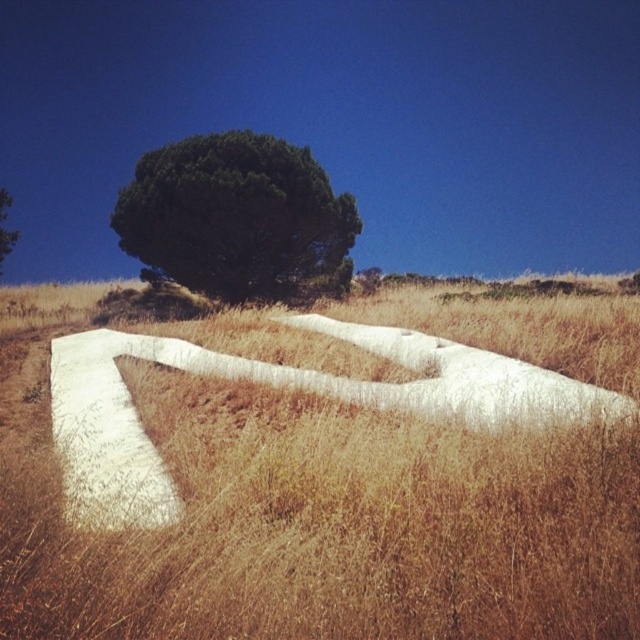
You are a botanist studying plant distribution in this landscape. You observe the dry grass at center. Based on its location coordinates, can you determine whether it is positioned closer to the bottom or the top of the image?

The dry grass at center is located at coordinates point [317,522]. Since the y coordinate is 0.498, which is just below the halfway point of the image, it is closer to the bottom of the image.

You are standing in the field of dry grass and want to walk towards the green leafy tree at upper center and the green leafy tree at upper left. Which tree will you reach first?

The green leafy tree at upper center will be reached first because it is closer to the viewer than the green leafy tree at upper left.

You are a photographer trying to capture the green leafy tree at upper left while ensuring the dry grass at center is visible in the foreground. Can you position yourself so both elements are in the frame without one blocking the other?

The dry grass at center is in front of the green leafy tree at upper left, so positioning yourself to include both would require angling the camera so the dry grass at center is visible in the foreground while the green leafy tree at upper left remains visible in the background.